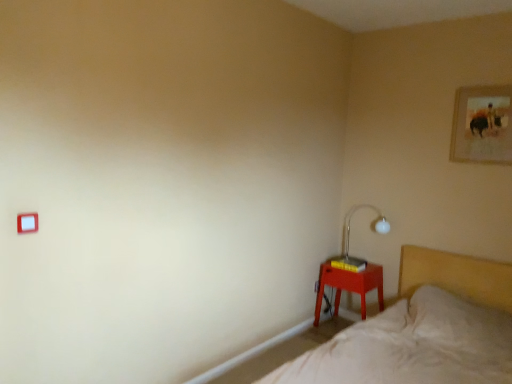
Question: Is point (493, 337) positioned closer to the camera than point (501, 147)?

Choices:
 (A) farther
 (B) closer

Answer: (B)

Question: Is beige fabric bed at lower right spatially inside gold-framed picture at upper right, or outside of it?

Choices:
 (A) outside
 (B) inside

Answer: (A)

Question: Estimate the real-world distances between objects in this image. Which object is closer to the white glass table lamp at right?

Choices:
 (A) white plastic light switch at upper left
 (B) gold-framed picture at upper right
 (C) beige fabric bed at lower right
 (D) matte plastic nightstand at lower right

Answer: (D)

Question: Estimate the real-world distances between objects in this image. Which object is farther from the matte plastic nightstand at lower right?

Choices:
 (A) white glass table lamp at right
 (B) gold-framed picture at upper right
 (C) white plastic light switch at upper left
 (D) beige fabric bed at lower right

Answer: (C)